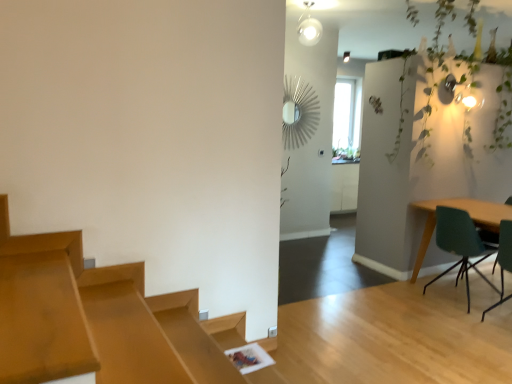
Question: Is teal fabric chair at right shorter than teal matte chair at right, which ranks as the 2th chair in front-to-back order?

Choices:
 (A) no
 (B) yes

Answer: (A)

Question: Are teal fabric chair at right and teal matte chair at right, which ranks as the 2th chair in front-to-back order, located far from each other?

Choices:
 (A) yes
 (B) no

Answer: (B)

Question: Is teal matte chair at right, which ranks as the 2th chair in front-to-back order, a part of teal fabric chair at right?

Choices:
 (A) no
 (B) yes

Answer: (A)

Question: Is teal fabric chair at right with teal matte chair at right, arranged as the first chair when viewed from the back?

Choices:
 (A) no
 (B) yes

Answer: (A)

Question: From a real-world perspective, is teal fabric chair at right positioned under teal matte chair at right, which ranks as the 2th chair in front-to-back order, based on gravity?

Choices:
 (A) yes
 (B) no

Answer: (B)

Question: Is green fabric chair at right, the 2th chair viewed from the back, to the left or to the right of teal matte chair at right, arranged as the first chair when viewed from the back, in the image?

Choices:
 (A) left
 (B) right

Answer: (B)

Question: Considering the positions of green fabric chair at right, placed as the first chair when sorted from front to back, and teal matte chair at right, which ranks as the 2th chair in front-to-back order, in the image, is green fabric chair at right, placed as the first chair when sorted from front to back, taller or shorter than teal matte chair at right, which ranks as the 2th chair in front-to-back order,?

Choices:
 (A) short
 (B) tall

Answer: (B)

Question: Is green fabric chair at right, the 2th chair viewed from the back, in front of or behind teal matte chair at right, arranged as the first chair when viewed from the back, in the image?

Choices:
 (A) behind
 (B) front

Answer: (B)

Question: From a real-world perspective, is green fabric chair at right, placed as the first chair when sorted from front to back, physically located above or below teal matte chair at right, which ranks as the 2th chair in front-to-back order?

Choices:
 (A) above
 (B) below

Answer: (A)

Question: In terms of height, does teal matte chair at right, which ranks as the 2th chair in front-to-back order, look taller or shorter compared to clear glass window at upper center?

Choices:
 (A) tall
 (B) short

Answer: (B)

Question: In the image, is teal matte chair at right, arranged as the first chair when viewed from the back, on the left side or the right side of clear glass window at upper center?

Choices:
 (A) left
 (B) right

Answer: (B)

Question: In terms of size, does teal matte chair at right, arranged as the first chair when viewed from the back, appear bigger or smaller than clear glass window at upper center?

Choices:
 (A) small
 (B) big

Answer: (B)

Question: Does point (442, 271) appear closer or farther from the camera than point (350, 132)?

Choices:
 (A) farther
 (B) closer

Answer: (B)

Question: From the image's perspective, relative to green leafy plant at upper right, is green fabric chair at right, the 2th chair viewed from the back, above or below?

Choices:
 (A) above
 (B) below

Answer: (B)

Question: In the image, is green fabric chair at right, placed as the first chair when sorted from front to back, on the left side or the right side of green leafy plant at upper right?

Choices:
 (A) left
 (B) right

Answer: (B)